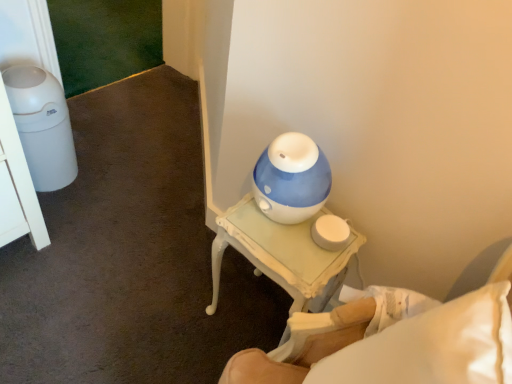
The width and height of the screenshot is (512, 384). What are the coordinates of `free space to the left of white painted wood table at center` in the screenshot? It's located at (173, 302).